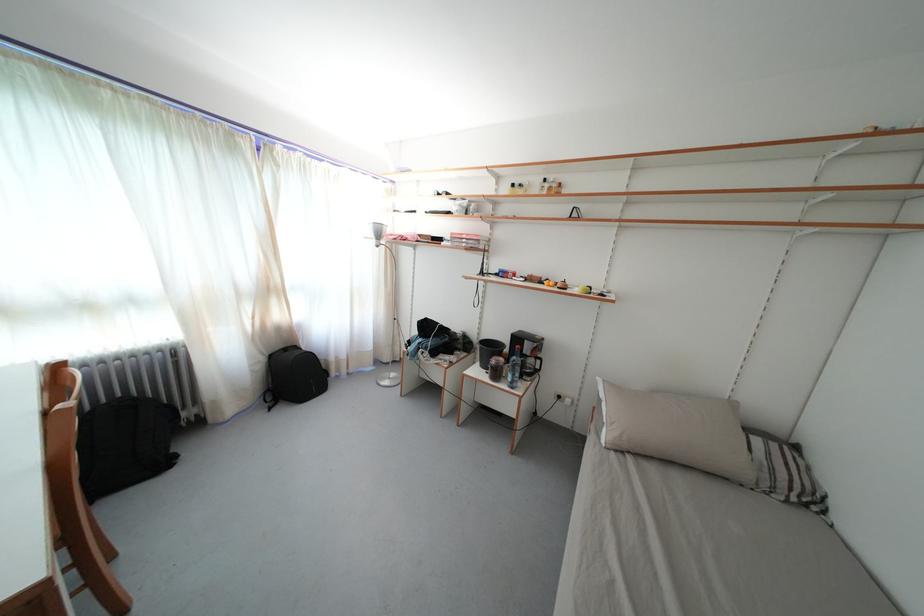
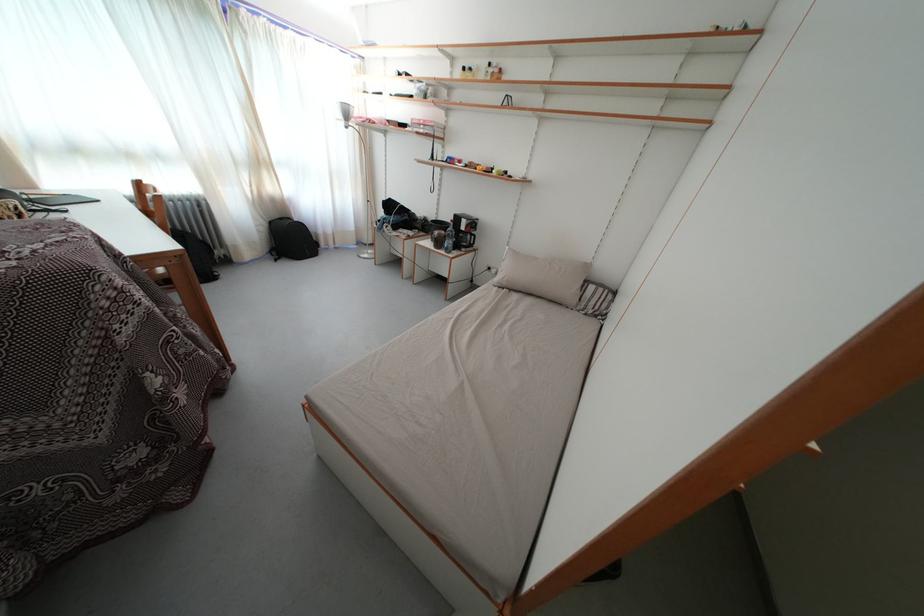
The point at (503, 379) is marked in the first image. Where is the corresponding point in the second image?

(444, 249)